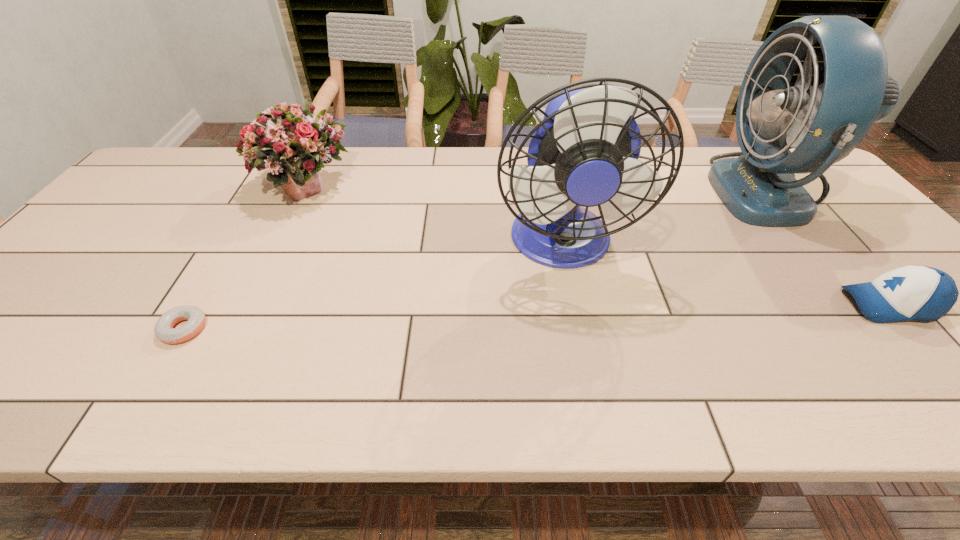
Find the location of a particular element. This screenshot has width=960, height=540. the right fan is located at coordinates tap(824, 118).

Where is `the left fan`? The width and height of the screenshot is (960, 540). the left fan is located at coordinates (585, 152).

Identify the location of the third tallest object. The height and width of the screenshot is (540, 960). (294, 145).

Image resolution: width=960 pixels, height=540 pixels. What are the coordinates of `the fourth tallest object` in the screenshot? It's located at 913,292.

You are a GUI agent. You are given a task and a screenshot of the screen. Output one action in this format:
    pyautogui.click(x=<x>, y=<y>)
    Task: Click on the doughnut
    Image resolution: width=960 pixels, height=540 pixels.
    Given the screenshot: What is the action you would take?
    pyautogui.click(x=164, y=331)

I want to click on vacant area situated in front of the right fan to blow air, so click(x=698, y=191).

Locate an element on the screen. This screenshot has height=540, width=960. vacant space positioned in front of the right fan to blow air is located at coordinates (674, 191).

I want to click on free space located in front of the right fan to blow air, so click(x=667, y=191).

This screenshot has height=540, width=960. Identify the location of free region located 0.090m in front of the left fan where the airflow is directed. (577, 322).

Locate an element on the screen. The width and height of the screenshot is (960, 540). vacant space situated 0.250m on the right of the bouquet is located at coordinates (437, 190).